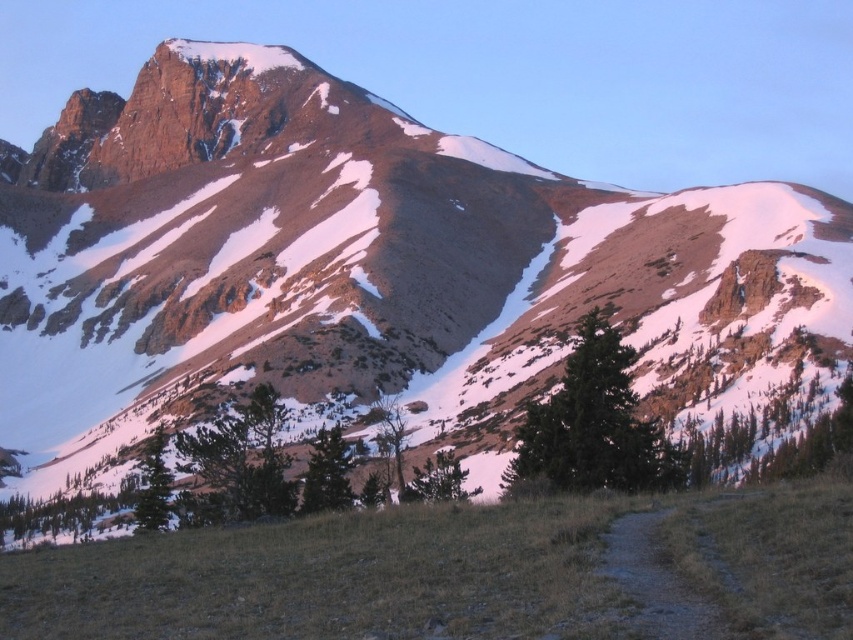
Is green textured tree at center to the left of green matte tree at lower center from the viewer's perspective?

In fact, green textured tree at center is to the right of green matte tree at lower center.

From the picture: Who is taller, green textured tree at center or green matte tree at lower center?

Standing taller between the two is green textured tree at center.

Who is more forward, (611,396) or (451,481)?

Point (611,396) is in front.

Locate an element on the screen. The width and height of the screenshot is (853, 640). green textured tree at center is located at coordinates click(593, 426).

Who is positioned more to the right, green matte tree at lower left or green matte tree at lower center?

From the viewer's perspective, green matte tree at lower center appears more on the right side.

This screenshot has height=640, width=853. What do you see at coordinates (154, 484) in the screenshot?
I see `green matte tree at lower left` at bounding box center [154, 484].

At what (x,y) coordinates should I click in order to perform the action: click on green matte tree at lower left. Please return your answer as a coordinate pair (x, y). Looking at the image, I should click on (154, 484).

This screenshot has height=640, width=853. Find the location of `green textured tree at center`. green textured tree at center is located at coordinates [593, 426].

What do you see at coordinates (593, 426) in the screenshot? The width and height of the screenshot is (853, 640). I see `green textured tree at center` at bounding box center [593, 426].

Does point (575, 392) lie in front of point (149, 451)?

Yes.

Locate an element on the screen. The height and width of the screenshot is (640, 853). green textured tree at center is located at coordinates (593, 426).